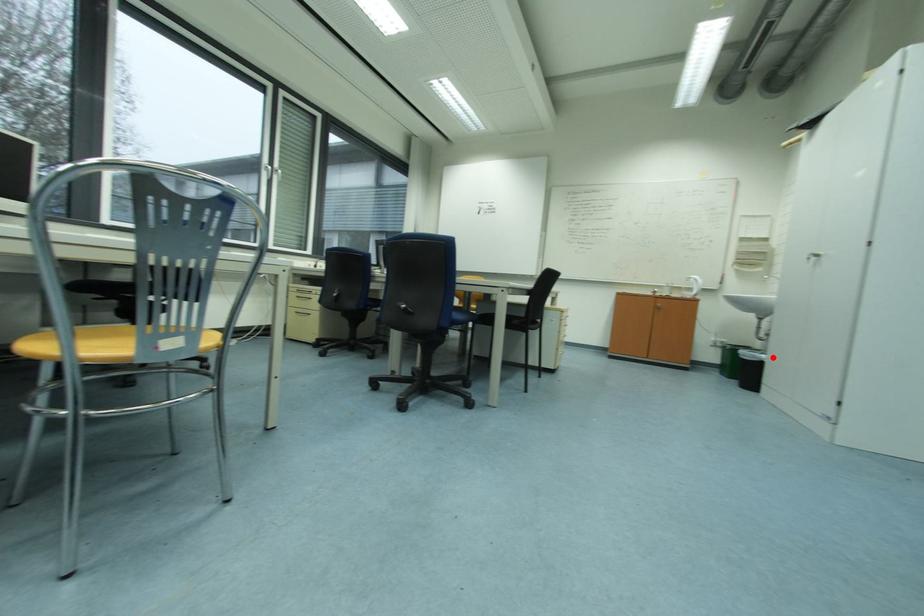
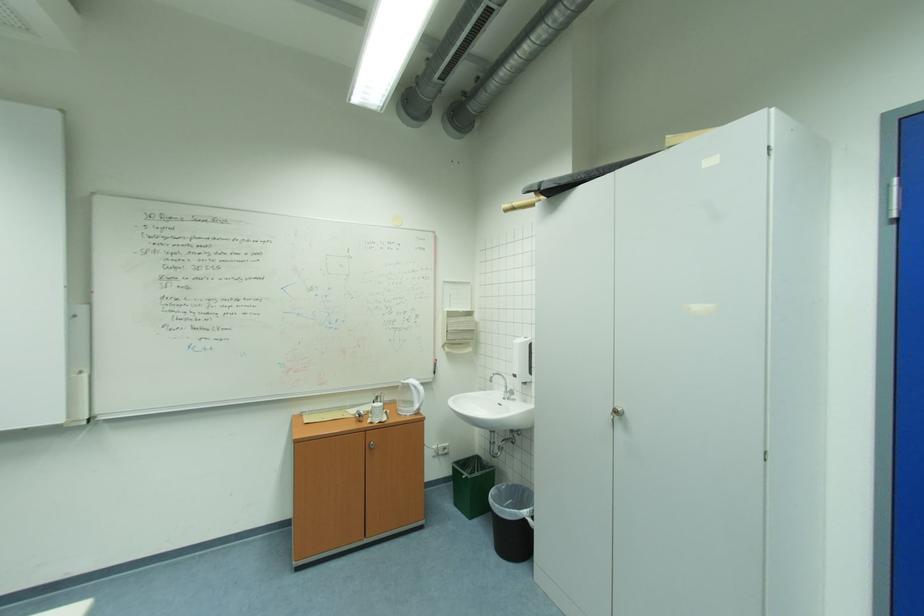
Question: I am providing you with two images of the same scene from different viewpoints. A red point is marked on the first image. Is the red point's position out of view in image 2?

Choices:
 (A) Yes
 (B) No

Answer: (B)